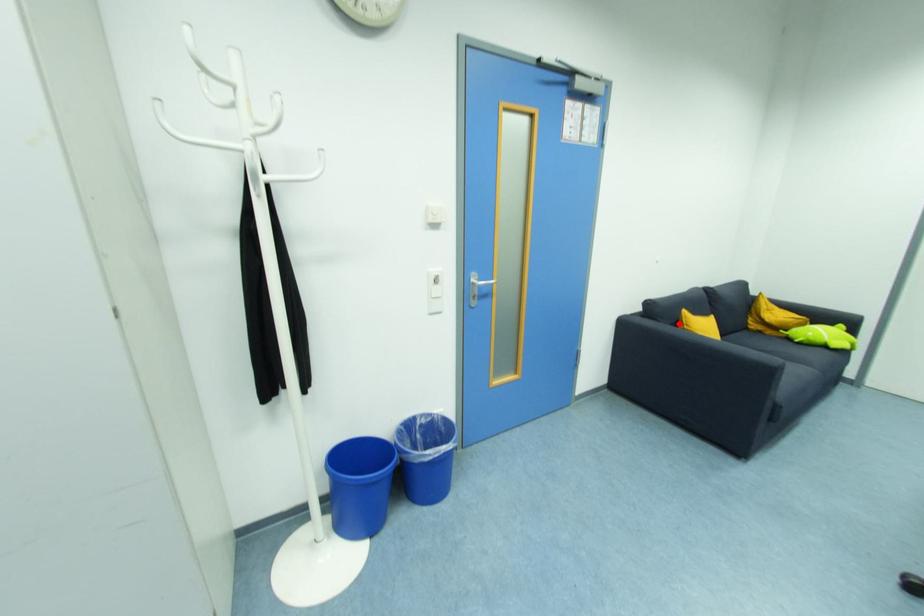
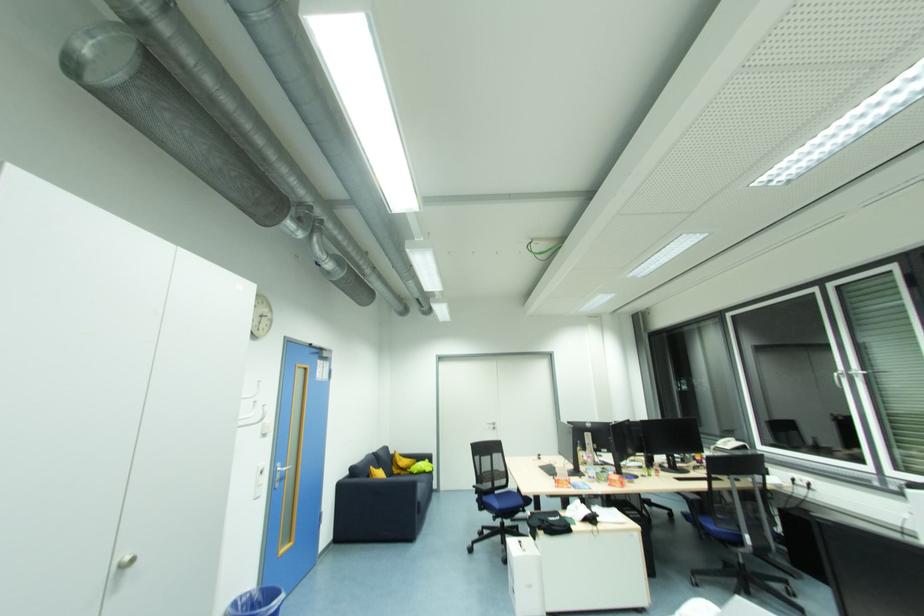
Locate, in the second image, the point that corresponds to the highlighted location in the first image.

(371, 477)